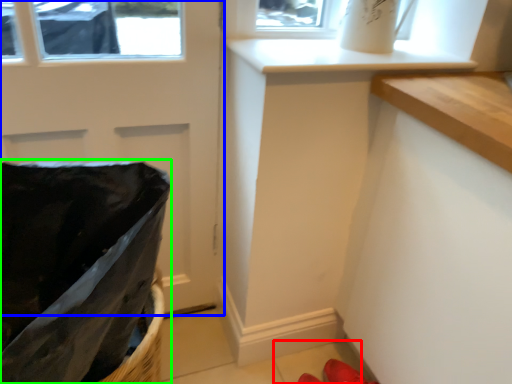
Question: Which object is positioned farthest from tile (highlighted by a red box)? Select from door (highlighted by a blue box) and laundry basket (highlighted by a green box).

Choices:
 (A) door
 (B) laundry basket

Answer: (B)